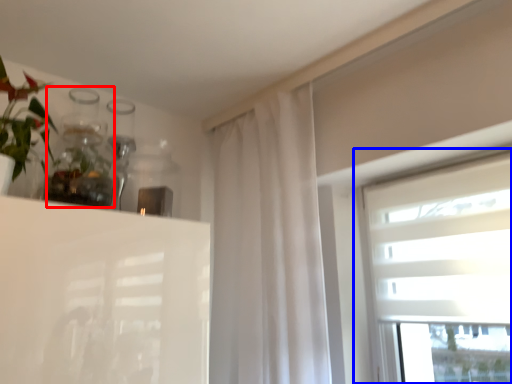
Question: Which point is further to the camera, glass vase (highlighted by a red box) or window (highlighted by a blue box)?

Choices:
 (A) glass vase
 (B) window

Answer: (B)